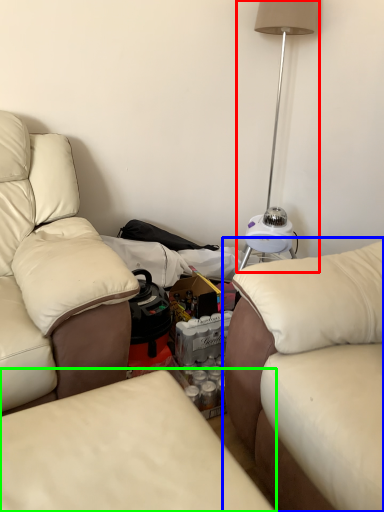
Question: Estimate the real-world distances between objects in this image. Which object is closer to table lamp (highlighted by a red box), studio couch (highlighted by a blue box) or studio couch (highlighted by a green box)?

Choices:
 (A) studio couch
 (B) studio couch

Answer: (A)